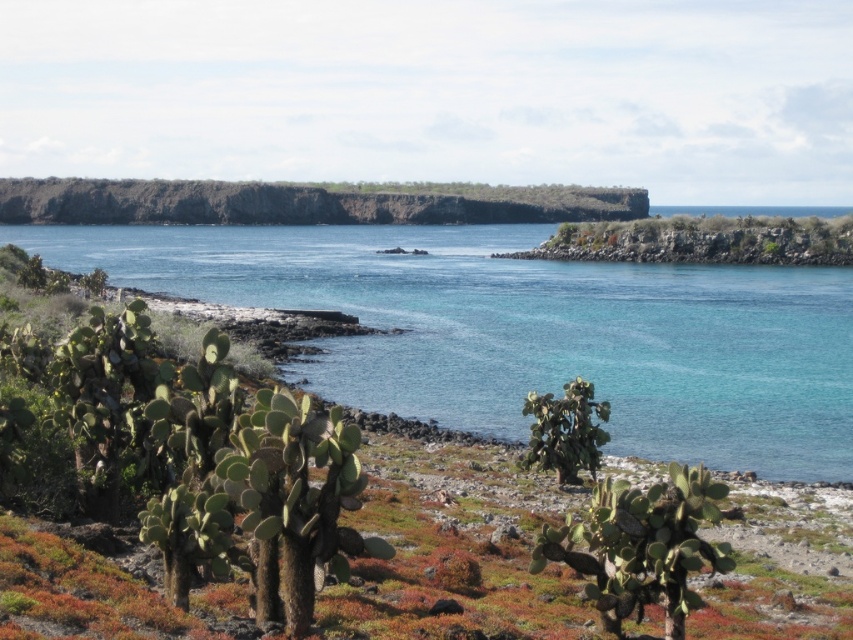
Question: Can you confirm if dark brown rocky cliff at upper center is positioned above green spiny cactus at center?

Choices:
 (A) no
 (B) yes

Answer: (B)

Question: Which point appears farthest from the camera in this image?

Choices:
 (A) (532, 396)
 (B) (337, 300)

Answer: (B)

Question: Estimate the real-world distances between objects in this image. Which object is farther from the clear blue water at lower left?

Choices:
 (A) green spiny cactus at center
 (B) dark brown rocky cliff at upper center

Answer: (B)

Question: Can you confirm if clear blue water at lower left is smaller than green spiny cactus at center?

Choices:
 (A) no
 (B) yes

Answer: (A)

Question: From the image, what is the correct spatial relationship of clear blue water at lower left in relation to dark brown rocky cliff at upper center?

Choices:
 (A) below
 (B) above

Answer: (A)

Question: Which point is farther from the camera taking this photo?

Choices:
 (A) (57, 220)
 (B) (595, 468)

Answer: (A)